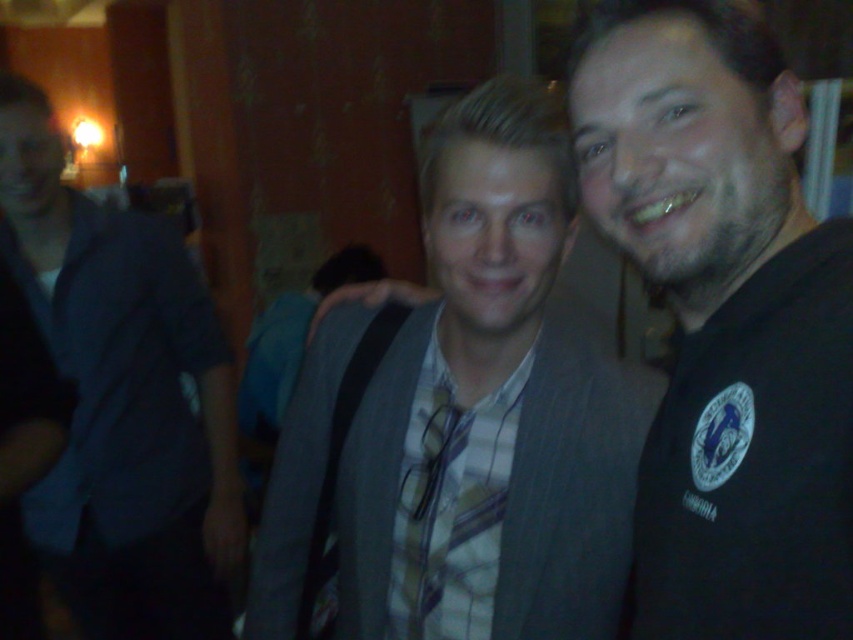
You are a photographer adjusting the camera settings for a group photo. You notice the matte gray suit at center and the dark blue shirt at left in your viewfinder. Which clothing item requires more space between the subjects to avoid overlapping in the frame?

The dark blue shirt at left requires more space between the subjects to avoid overlapping in the frame because the matte gray suit at center is narrower than the dark blue shirt at left.

You are a photographer trying to adjust the lighting for a group photo. You notice the dark blue shirt at left and the yellow plaid tie at center in the scene. Which of these two items requires more light adjustment to ensure proper exposure?

The dark blue shirt at left requires more light adjustment because it is wider than the yellow plaid tie at center, making it cover a larger area that needs even lighting.

You are a photographer adjusting the framing for a group photo. You notice the matte gray suit at center and the yellow plaid tie at center in your viewfinder. Which object should you ensure is fully visible first to maintain proper composition?

Since the matte gray suit at center is wider than the yellow plaid tie at center, you should prioritize ensuring the matte gray suit at center is fully visible first to maintain proper composition.